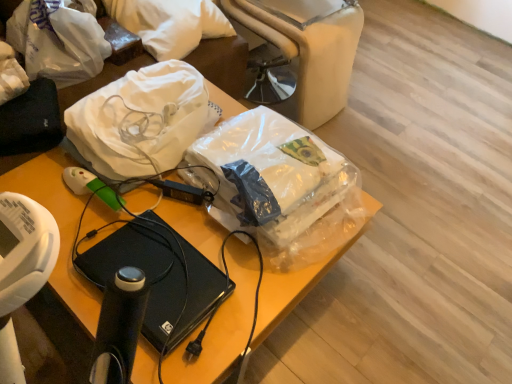
Image resolution: width=512 pixels, height=384 pixels. What are the coordinates of `vacant space in front of transparent plastic bag at upper center, placed as the second plastic bag when sorted from right to left` in the screenshot? It's located at (126, 221).